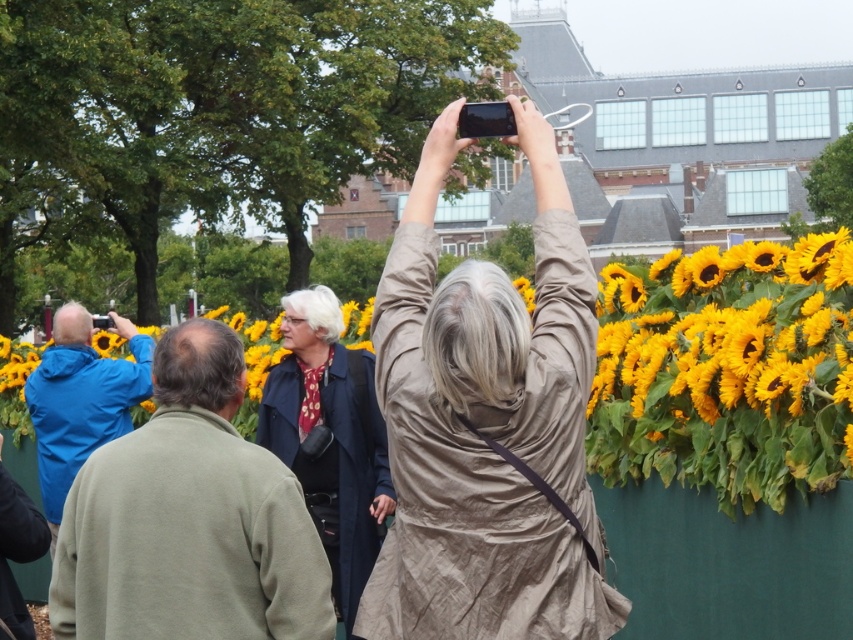
Question: Does matte blue jacket at left lie behind dark blue coat at center?

Choices:
 (A) no
 (B) yes

Answer: (A)

Question: Observing the image, what is the correct spatial positioning of matte beige dress at center in reference to matte blue jacket at left?

Choices:
 (A) above
 (B) below

Answer: (A)

Question: Is matte beige dress at center bigger than matte blue jacket at left?

Choices:
 (A) no
 (B) yes

Answer: (B)

Question: Which of the following is the farthest from the observer?

Choices:
 (A) dark blue coat at center
 (B) matte beige dress at center
 (C) matte blue jacket at left

Answer: (A)

Question: Which object appears closest to the camera in this image?

Choices:
 (A) matte beige dress at center
 (B) dark blue coat at center
 (C) matte blue jacket at left

Answer: (A)

Question: Among these objects, which one is farthest from the camera?

Choices:
 (A) dark blue coat at center
 (B) matte blue jacket at left
 (C) matte beige dress at center

Answer: (A)